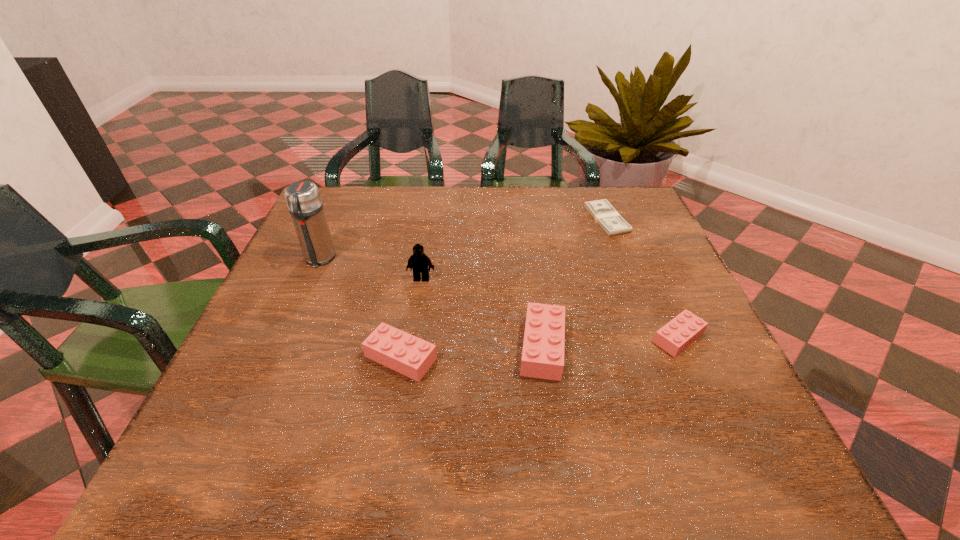
Image resolution: width=960 pixels, height=540 pixels. I want to click on free space between the farthest object and the farthest Lego, so click(x=514, y=249).

Where is `empty space that is in between the farthest object and the shortest Lego`? empty space that is in between the farthest object and the shortest Lego is located at coordinates (642, 279).

I want to click on free spot between the tallest object and the fourth tallest object, so click(x=360, y=308).

Locate an element on the screen. free space between the fifth shortest object and the second shortest Lego is located at coordinates (411, 318).

Where is `free space between the farthest object and the third tallest Lego`? free space between the farthest object and the third tallest Lego is located at coordinates (504, 288).

Locate an element on the screen. free spot between the thermos bottle and the second tallest Lego is located at coordinates (431, 303).

The image size is (960, 540). Find the location of `empty space between the second shortest Lego and the farthest Lego`. empty space between the second shortest Lego and the farthest Lego is located at coordinates (411, 318).

Select which object is the fourth closest to the tallest object. Please provide its 2D coordinates. Your answer should be formatted as a tuple, i.e. [(x, y)], where the tuple contains the x and y coordinates of a point satisfying the conditions above.

[(602, 211)]

Find the location of a particular element. The width and height of the screenshot is (960, 540). object that stands as the fifth closest to the second tallest Lego is located at coordinates (x=303, y=198).

Locate an element on the screen. The height and width of the screenshot is (540, 960). Lego that is the closest one to the fifth shortest object is located at coordinates (402, 352).